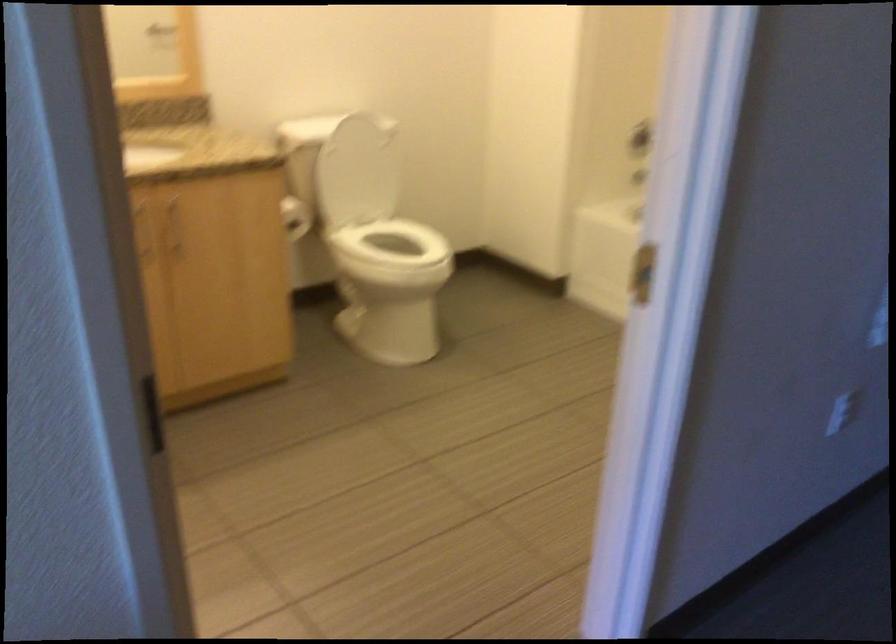
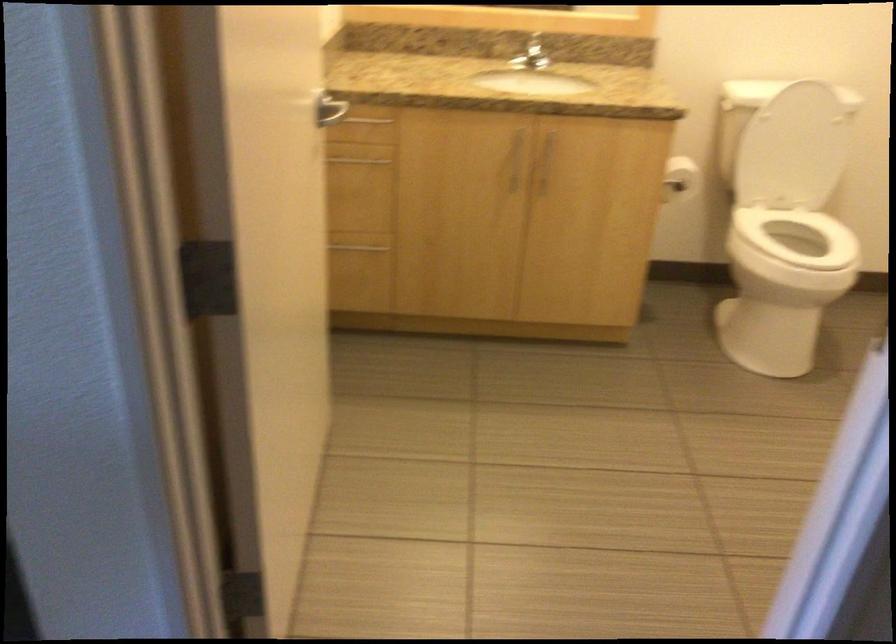
Question: The images are taken continuously from a first-person perspective. In which direction is your viewpoint rotating?

Choices:
 (A) Left
 (B) Right
 (C) Up
 (D) Down

Answer: (A)